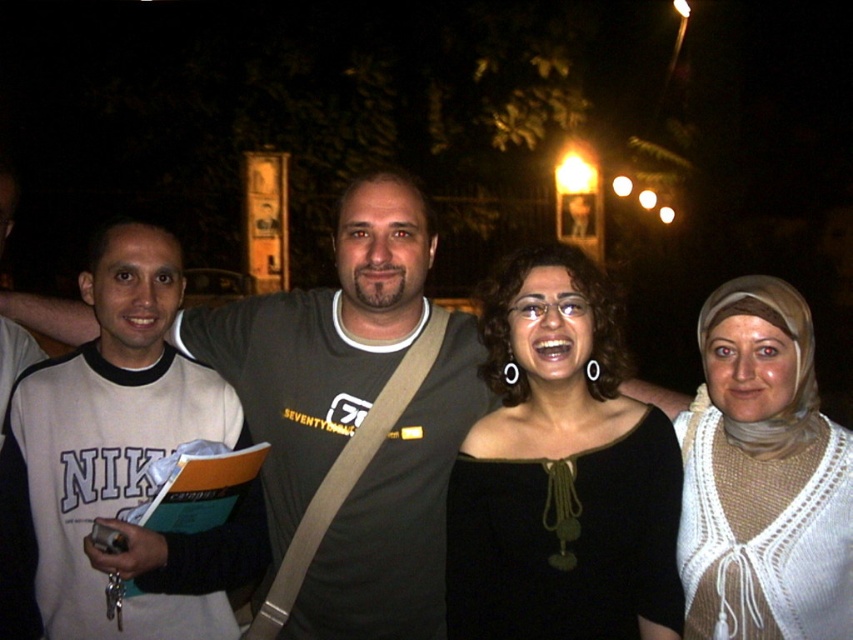
You are a photographer trying to capture the group photo. You notice the white knitted scarf at right and the gray cotton shirt at center. Which one should you focus on first if you want to ensure both are in sharp focus?

The white knitted scarf at right is located above the gray cotton shirt at center, so you should focus on the gray cotton shirt at center first to ensure both are in sharp focus since it is closer to the camera.

You are a photographer who just arrived at the park and need to locate the white cotton shirt at left. According to the coordinates provided, where should you look to find it?

The white cotton shirt at left is located at point (x=119, y=461).

You are a photographer trying to capture a clear shot of both the black matte top at center and the white cotton shirt at left. Since the lighting is low, you need to adjust your camera focus. Which clothing item should you focus on first to ensure it appears sharp in the photo?

The black matte top at center is positioned under the white cotton shirt at left, so focusing on the white cotton shirt at left first would ensure it stays sharp while the black matte top at center remains in focus due to its lower position.